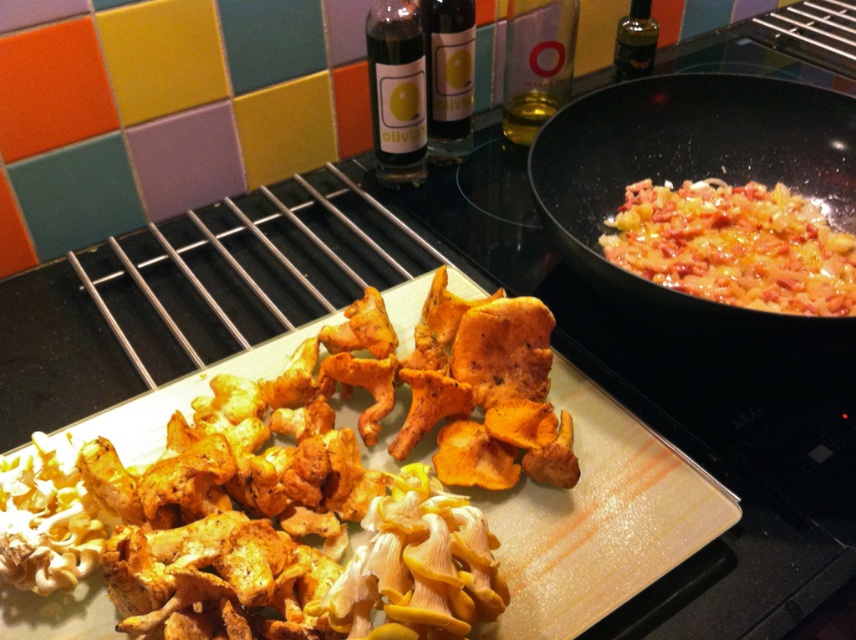
You are a chef preparing a dish and need to choose a bottle for storing mushroom pieces. Both the matte glass bottle at upper center and the clear glass bottle at upper center are available. Which bottle should you choose if you want the taller one?

The matte glass bottle at upper center has a greater height compared to the clear glass bottle at upper center, so you should choose the matte glass bottle at upper center.

What is located at the coordinates point (735, 246) in the image?

The coordinates point (735, 246) indicate the location of shiny golden pasta at right.

You are a chef preparing a dish and need to grab a bottle from the upper center area. Which bottle, the matte glass bottle at upper center or the clear glass bottle at upper center, is easier to reach without moving the other?

The matte glass bottle at upper center is in front of the clear glass bottle at upper center, so it is easier to reach without moving the other.